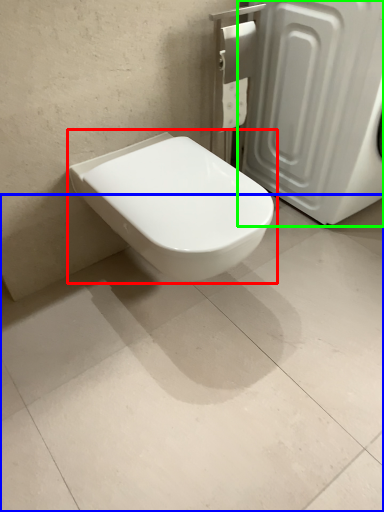
Question: Which is nearer to the toilet (highlighted by a red box)? concrete (highlighted by a blue box) or screen door (highlighted by a green box).

Choices:
 (A) concrete
 (B) screen door

Answer: (A)